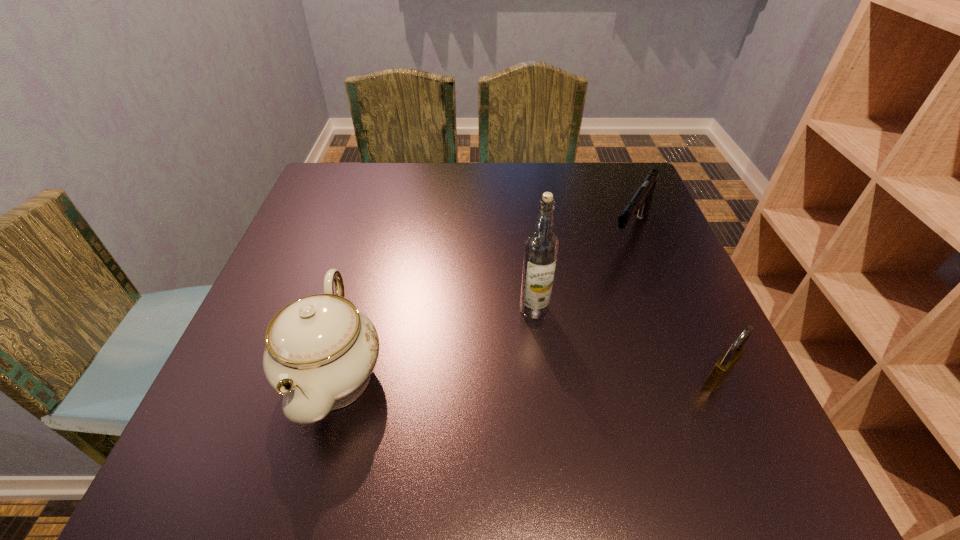
This screenshot has width=960, height=540. I want to click on vacant spot on the desktop that is between the leftmost object and the padlock and is positioned at the aiming end of the gun, so click(x=538, y=377).

The height and width of the screenshot is (540, 960). I want to click on free space on the desktop that is between the leftmost object and the padlock and is positioned on the label of the tallest object, so click(x=468, y=376).